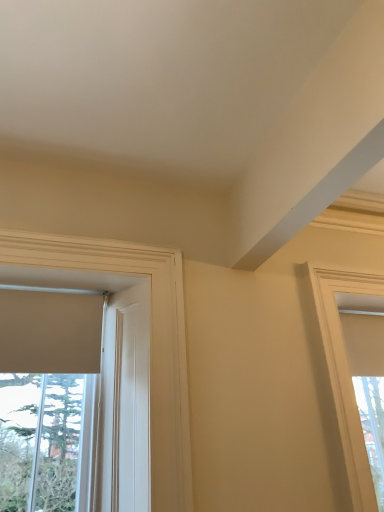
Question: Is matte white window at right, which ranks as the 2th window in left-to-right order, bigger or smaller than white matte window at left, which ranks as the 1th window in left-to-right order?

Choices:
 (A) big
 (B) small

Answer: (B)

Question: In terms of width, does matte white window at right, which ranks as the 2th window in left-to-right order, look wider or thinner when compared to white matte window at left, the 2th window in the right-to-left sequence?

Choices:
 (A) thin
 (B) wide

Answer: (A)

Question: From their relative heights in the image, would you say matte white window at right, the first window when ordered from right to left, is taller or shorter than white matte window at left, the 2th window in the right-to-left sequence?

Choices:
 (A) short
 (B) tall

Answer: (B)

Question: Based on their positions, is white matte window at left, the 2th window in the right-to-left sequence, located to the left or right of matte white window at right, the first window when ordered from right to left?

Choices:
 (A) right
 (B) left

Answer: (B)

Question: From the image's perspective, is white matte window at left, which ranks as the 1th window in left-to-right order, positioned above or below matte white window at right, which ranks as the 2th window in left-to-right order?

Choices:
 (A) above
 (B) below

Answer: (A)

Question: From their relative heights in the image, would you say white matte window at left, the 2th window in the right-to-left sequence, is taller or shorter than matte white window at right, which ranks as the 2th window in left-to-right order?

Choices:
 (A) tall
 (B) short

Answer: (B)

Question: Relative to matte white window at right, which ranks as the 2th window in left-to-right order, is white matte window at left, the 2th window in the right-to-left sequence, in front or behind?

Choices:
 (A) front
 (B) behind

Answer: (A)